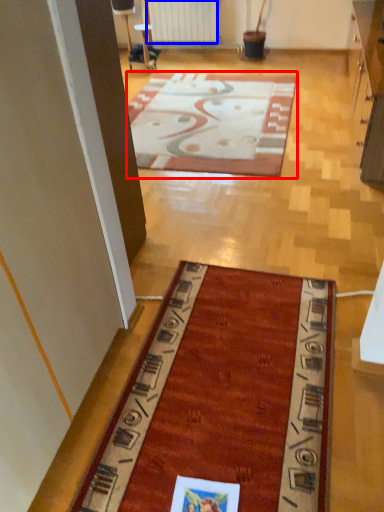
Question: Which of the following is the farthest to the observer, mat (highlighted by a red box) or radiator (highlighted by a blue box)?

Choices:
 (A) mat
 (B) radiator

Answer: (B)